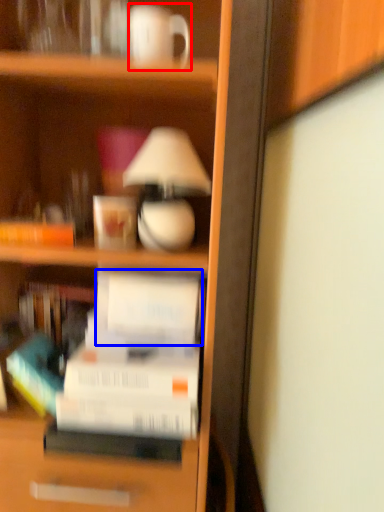
Question: Which object is further to the camera taking this photo, coffee cup (highlighted by a red box) or paperback book (highlighted by a blue box)?

Choices:
 (A) coffee cup
 (B) paperback book

Answer: (B)